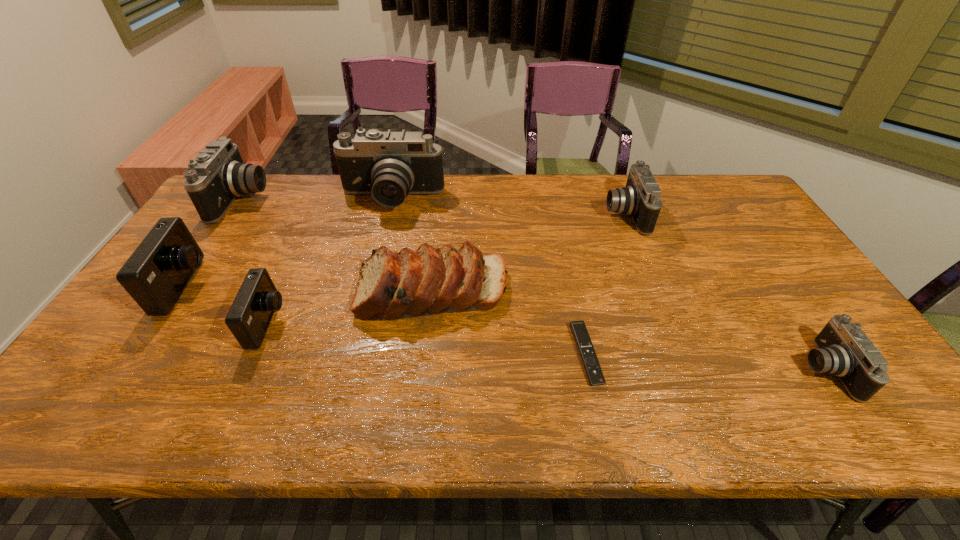
Identify the location of the biggest black camera. (389, 165).

This screenshot has height=540, width=960. In order to click on the tallest camera in this screenshot , I will do `click(389, 165)`.

You are a GUI agent. You are given a task and a screenshot of the screen. Output one action in this format:
    pyautogui.click(x=<x>, y=<y>)
    Task: Click on the seventh shortest object
    This screenshot has width=960, height=540.
    Given the screenshot: What is the action you would take?
    pyautogui.click(x=217, y=176)

Locate an element on the screen. the second tallest camera is located at coordinates (217, 176).

This screenshot has width=960, height=540. What are the coordinates of `the bigger blue camera` in the screenshot? It's located at (155, 275).

Find the location of a particular element. the second object from right to left is located at coordinates (640, 199).

This screenshot has height=540, width=960. In order to click on the fifth camera from left to right in this screenshot , I will do point(640,199).

Locate an element on the screen. bread is located at coordinates (391, 285).

I want to click on the right blue camera, so click(248, 319).

This screenshot has height=540, width=960. What are the coordinates of `the sixth object from right to left` in the screenshot? It's located at (248, 319).